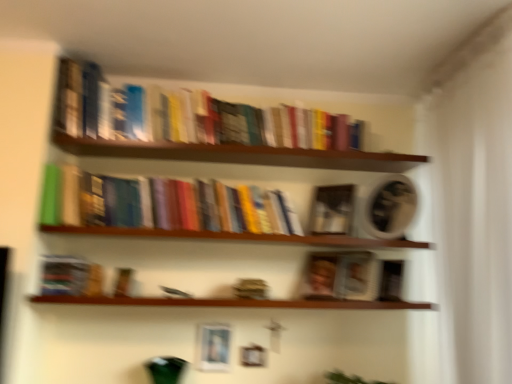
Question: Does matte black book at center, positioned as the second paperback book in right-to-left order, appear on the right side of matte silver picture frame at lower center?

Choices:
 (A) yes
 (B) no

Answer: (A)

Question: Is matte black book at center, which ranks as the 1th paperback book in top-to-bottom order, shorter than matte silver picture frame at lower center?

Choices:
 (A) yes
 (B) no

Answer: (B)

Question: From the image's perspective, is matte black book at center, positioned as the second paperback book in right-to-left order, above matte silver picture frame at lower center?

Choices:
 (A) yes
 (B) no

Answer: (A)

Question: Is matte black book at center, which ranks as the 1th paperback book in top-to-bottom order, looking in the opposite direction of matte silver picture frame at lower center?

Choices:
 (A) yes
 (B) no

Answer: (B)

Question: Does matte black book at center, positioned as the second paperback book in right-to-left order, have a greater height compared to matte silver picture frame at lower center?

Choices:
 (A) no
 (B) yes

Answer: (B)

Question: Based on their positions, is matte brown book at center, marked as the 2th paperback book in a top-to-bottom arrangement, located to the left or right of wooden shelf at center, which is counted as the first window sill, starting from the top?

Choices:
 (A) right
 (B) left

Answer: (A)

Question: In terms of height, does matte brown book at center, marked as the first paperback book in a bottom-to-top arrangement, look taller or shorter compared to wooden shelf at center, acting as the second window sill starting from the bottom?

Choices:
 (A) short
 (B) tall

Answer: (B)

Question: Choose the correct answer: Is matte brown book at center, the first paperback book from the right, inside wooden shelf at center, acting as the second window sill starting from the bottom, or outside it?

Choices:
 (A) inside
 (B) outside

Answer: (B)

Question: From a real-world perspective, is matte brown book at center, acting as the 2th paperback book starting from the left, physically located above or below wooden shelf at center, acting as the second window sill starting from the bottom?

Choices:
 (A) above
 (B) below

Answer: (B)

Question: Considering the positions of wooden shelf at lower center, which is the 2th window sill in top-to-bottom order, and matte silver picture frame at lower center in the image, is wooden shelf at lower center, which is the 2th window sill in top-to-bottom order, taller or shorter than matte silver picture frame at lower center?

Choices:
 (A) tall
 (B) short

Answer: (B)

Question: From a real-world perspective, is wooden shelf at lower center, the first window sill in the bottom-to-top sequence, physically located above or below matte silver picture frame at lower center?

Choices:
 (A) above
 (B) below

Answer: (A)

Question: Is point (267, 304) closer or farther from the camera than point (229, 329)?

Choices:
 (A) farther
 (B) closer

Answer: (B)

Question: From the image's perspective, is wooden shelf at lower center, which is the 2th window sill in top-to-bottom order, positioned above or below matte silver picture frame at lower center?

Choices:
 (A) below
 (B) above

Answer: (B)

Question: Considering the positions of wooden shelf at lower center, the first window sill in the bottom-to-top sequence, and wooden shelf at center, acting as the second window sill starting from the bottom, in the image, is wooden shelf at lower center, the first window sill in the bottom-to-top sequence, wider or thinner than wooden shelf at center, acting as the second window sill starting from the bottom,?

Choices:
 (A) thin
 (B) wide

Answer: (B)

Question: Is wooden shelf at lower center, the first window sill in the bottom-to-top sequence, bigger or smaller than wooden shelf at center, acting as the second window sill starting from the bottom?

Choices:
 (A) big
 (B) small

Answer: (B)